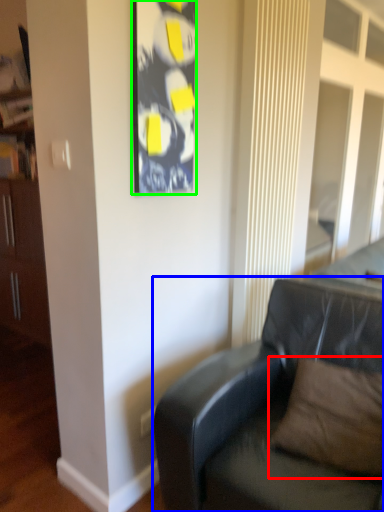
Question: Estimate the real-world distances between objects in this image. Which object is closer to pillow (highlighted by a red box), studio couch (highlighted by a blue box) or picture frame (highlighted by a green box)?

Choices:
 (A) studio couch
 (B) picture frame

Answer: (A)